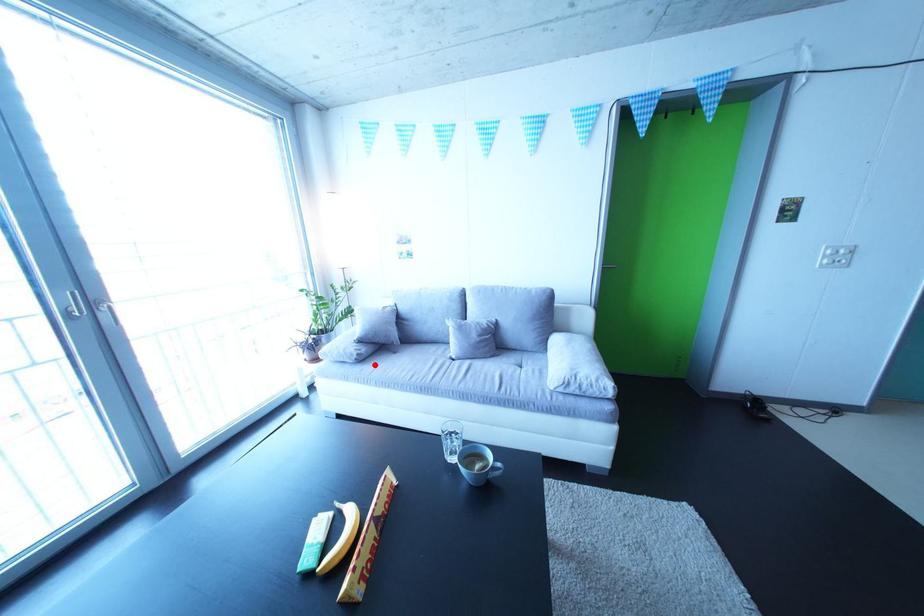
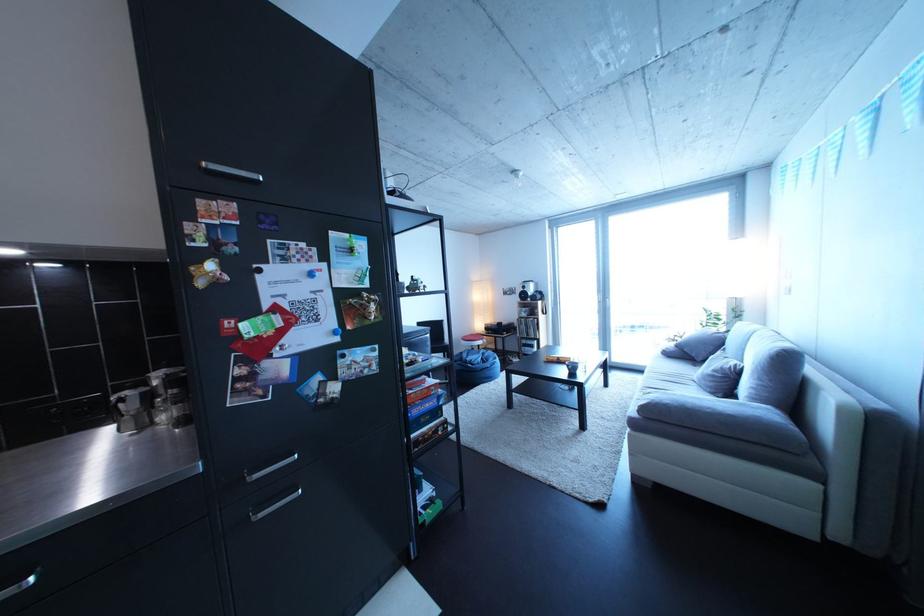
Locate, in the second image, the point that corresponds to the highlighted location in the first image.

(682, 361)